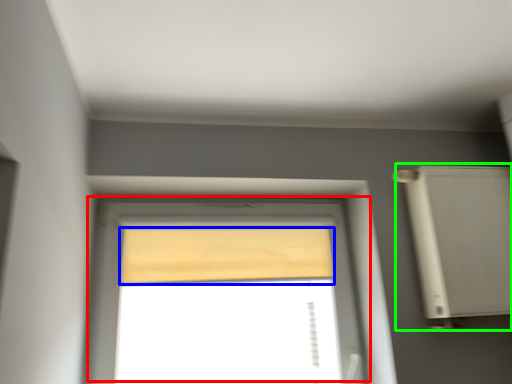
Question: Considering the real-world distances, which object is closest to window (highlighted by a red box)? curtain (highlighted by a blue box) or air conditioner (highlighted by a green box).

Choices:
 (A) curtain
 (B) air conditioner

Answer: (A)